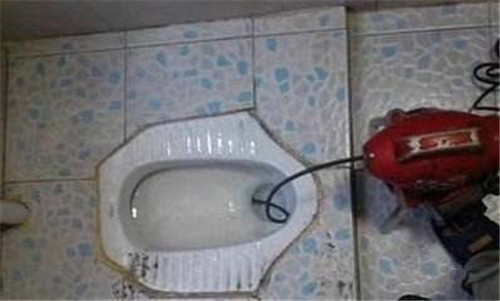
Identify the location of rim of toilet. (188, 145), (119, 170), (202, 260), (310, 198).